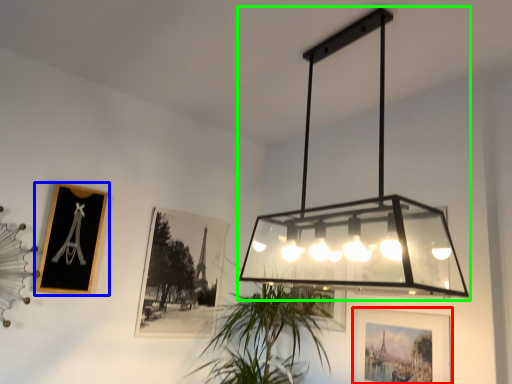
Question: Which is farther away from picture frame (highlighted by a red box)? picture frame (highlighted by a blue box) or lamp (highlighted by a green box)?

Choices:
 (A) picture frame
 (B) lamp

Answer: (A)